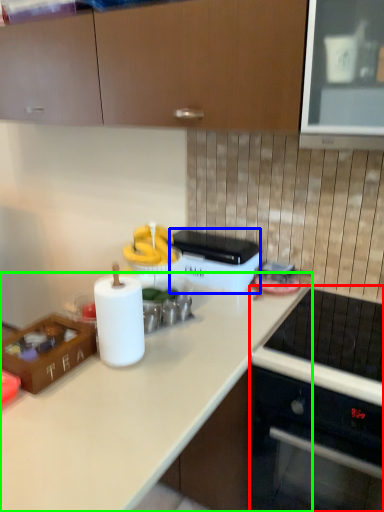
Question: Estimate the real-world distances between objects in this image. Which object is closer to home appliance (highlighted by a red box), appliance (highlighted by a blue box) or countertop (highlighted by a green box)?

Choices:
 (A) appliance
 (B) countertop

Answer: (B)